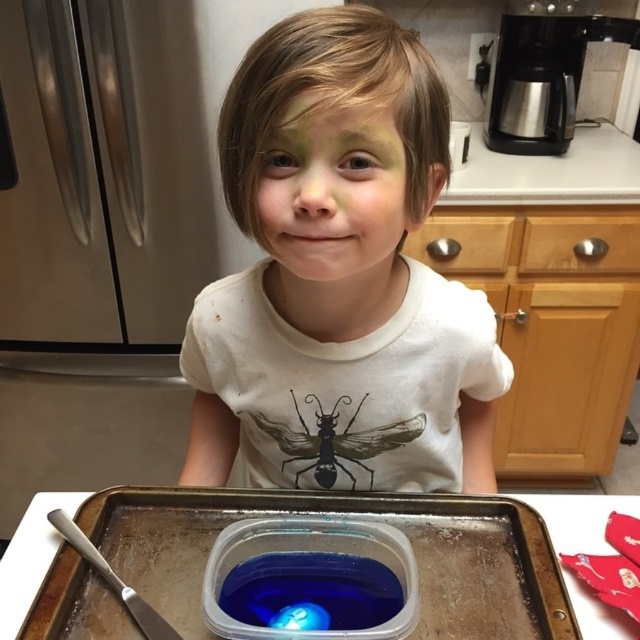
Question: Which object is closer to the camera taking this photo?

Choices:
 (A) black matte insect at center
 (B) white matte shirt at center

Answer: (B)

Question: Can you confirm if white matte shirt at center is positioned above metallic silver tray at center?

Choices:
 (A) no
 (B) yes

Answer: (B)

Question: Which point is closer to the camera?

Choices:
 (A) (337, 116)
 (B) (132, 525)
 (C) (358, 410)

Answer: (A)

Question: Which point is closer to the camera?

Choices:
 (A) black matte insect at center
 (B) metallic silver tray at center
 (C) white matte shirt at center
 (D) green matte face at center

Answer: (C)

Question: Is white matte shirt at center further to camera compared to metallic silver tray at center?

Choices:
 (A) no
 (B) yes

Answer: (A)

Question: In this image, where is green matte face at center located relative to black matte insect at center?

Choices:
 (A) right
 (B) left

Answer: (B)